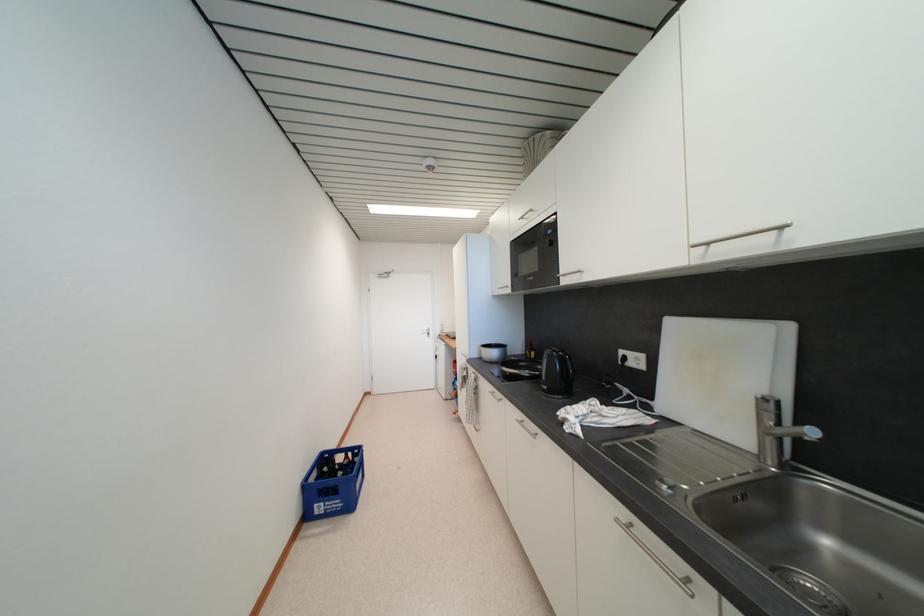
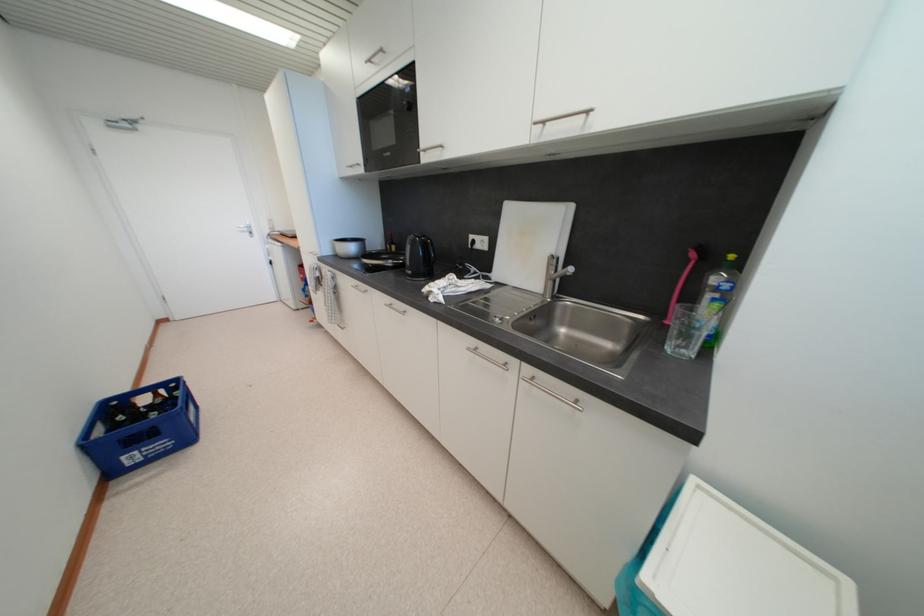
Locate, in the second image, the point that corresponds to [527,220] in the first image.

(375, 63)